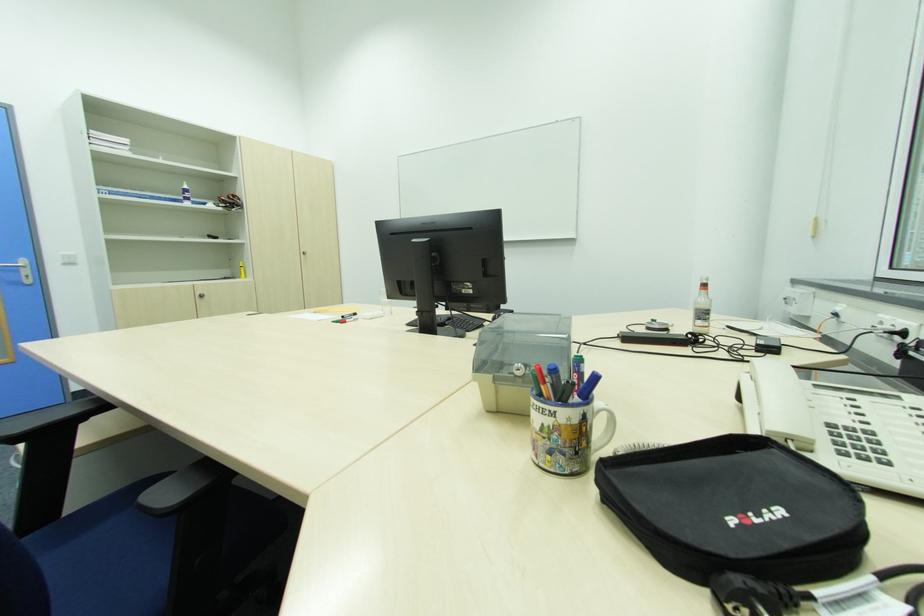
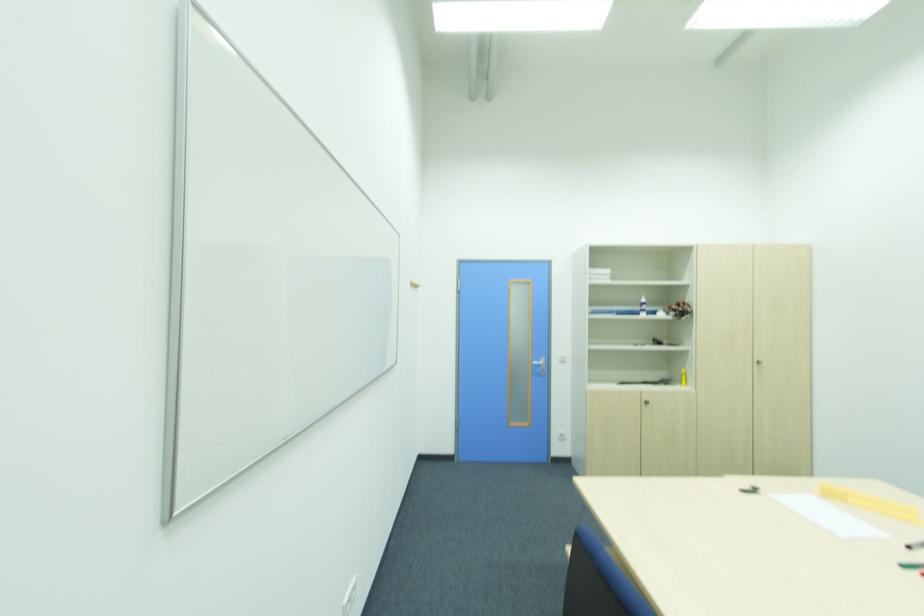
Locate, in the second image, the point that corresponds to pixel 204 297 in the first image.

(650, 402)